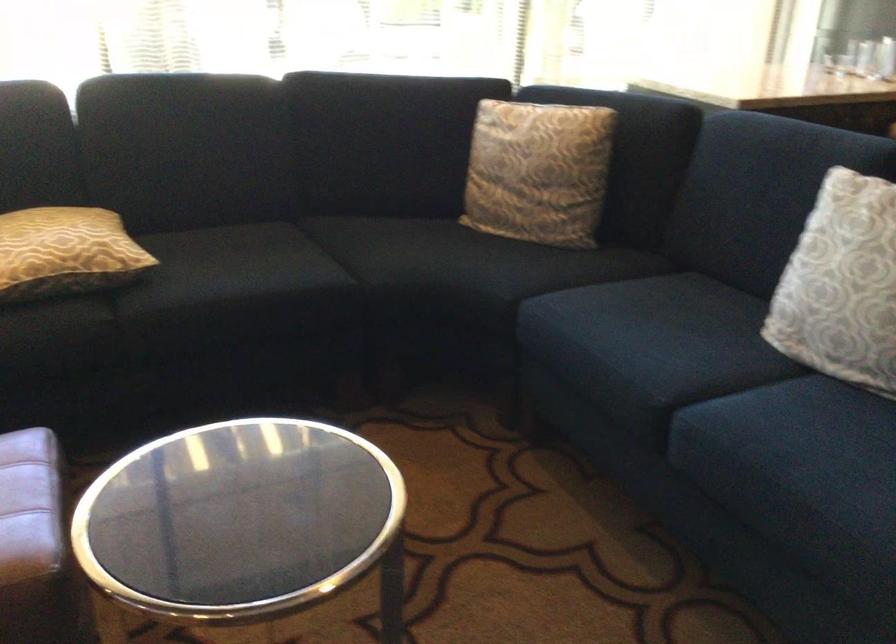
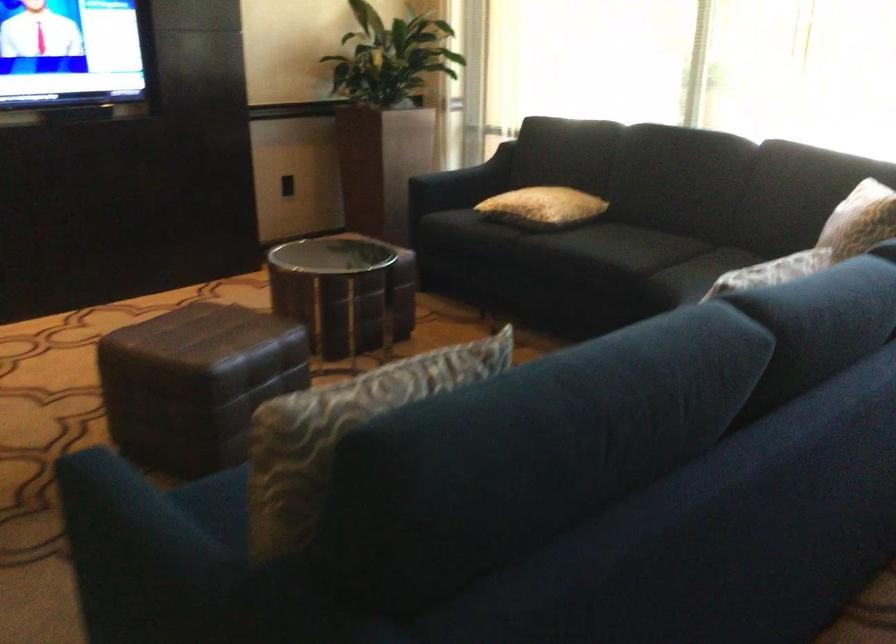
In the second image, find the point that corresponds to the point at 595,146 in the first image.

(859, 220)